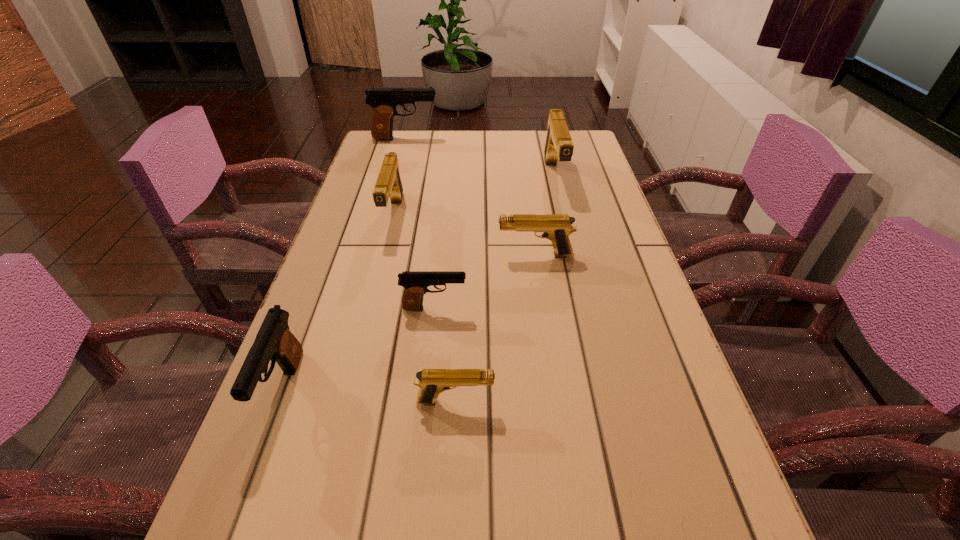
The width and height of the screenshot is (960, 540). I want to click on the farthest black pistol, so click(x=384, y=100).

Locate an element on the screen. the biggest black pistol is located at coordinates (384, 100).

Find the location of a particular element. This screenshot has width=960, height=540. the biggest tan pistol is located at coordinates (558, 145).

This screenshot has width=960, height=540. I want to click on the second biggest tan pistol, so click(x=388, y=184).

Where is `the second biggest black pistol`? The image size is (960, 540). the second biggest black pistol is located at coordinates (274, 341).

At what (x,y) coordinates should I click in order to perform the action: click on the fourth farthest pistol. Please return your answer as a coordinate pair (x, y). Looking at the image, I should click on (557, 227).

Where is `the second smallest tan pistol`? the second smallest tan pistol is located at coordinates (557, 227).

Where is `the fifth farthest object`? the fifth farthest object is located at coordinates (415, 283).

Where is `the third nearest pistol`? The height and width of the screenshot is (540, 960). the third nearest pistol is located at coordinates (415, 283).

Image resolution: width=960 pixels, height=540 pixels. I want to click on the shortest object, so click(432, 382).